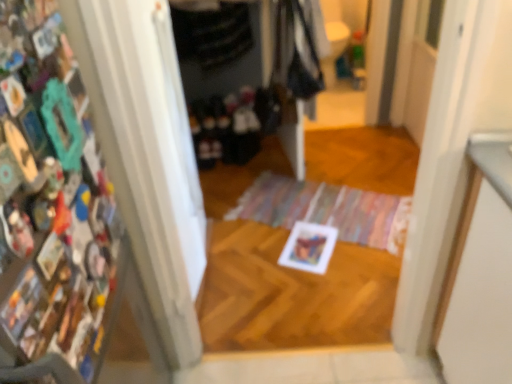
Question: Is dark fabric clothes at center, arranged as the first clothing when ordered from the bottom, wider or thinner than multicolored woven mat at center?

Choices:
 (A) thin
 (B) wide

Answer: (A)

Question: Does point pos(229,155) appear closer or farther from the camera than point pos(392,251)?

Choices:
 (A) closer
 (B) farther

Answer: (B)

Question: Which of these objects is positioned farthest from the dark gray fabric at upper center, the first clothing viewed from the top?

Choices:
 (A) dark fabric clothes at center, arranged as the first clothing when ordered from the bottom
 (B) multicolored collage at left
 (C) multicolored woven mat at center

Answer: (B)

Question: Considering the real-world distances, which object is farthest from the dark gray fabric at upper center, the 2th clothing ordered from the bottom?

Choices:
 (A) multicolored collage at left
 (B) multicolored woven mat at center
 (C) dark fabric clothes at center, which ranks as the 2th clothing in top-to-bottom order

Answer: (A)